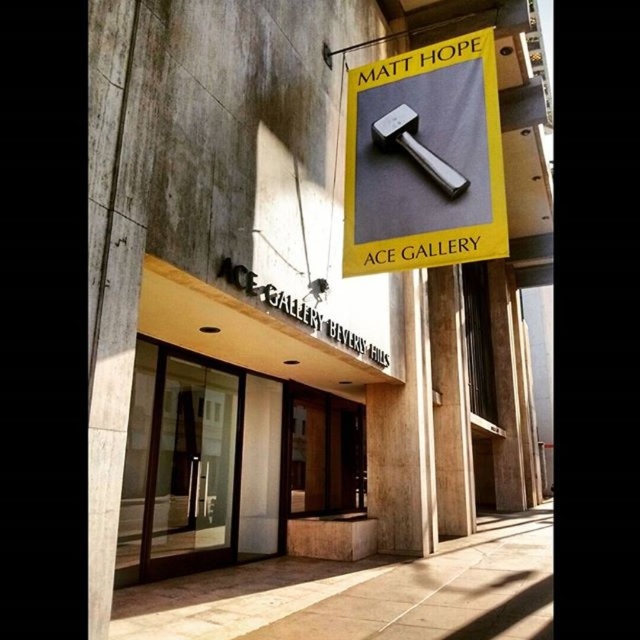
You are a visitor standing at the entrance of the Ace Gallery. You notice the metallic hammer at upper center and the transparent glass door at center. How far apart are these two items from each other?

The metallic hammer at upper center is 3.79 meters away from the transparent glass door at center.